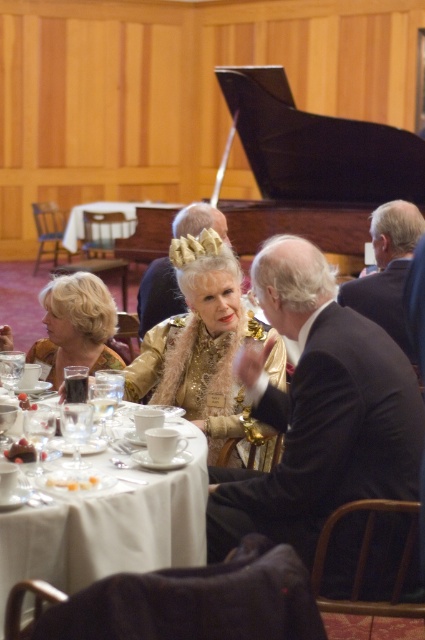
You are a guest at this event and want to pick up the white porcelain cup at center. However, the gold textured crown at center is blocking your access. Can you reach the cup without moving the crown?

The white porcelain cup at center is behind the gold textured crown at center, so you cannot reach it without moving the crown.

You are a photographer at the event and want to ensure both the gold sequined dress at center and the dark suit at right are visible in your photo. Given that the camera frame can only accommodate objects of the same size, will you need to adjust the framing to include both?

The gold sequened dress at center is larger in size than dark suit at right, so you will need to adjust the framing to ensure both are visible as their sizes differ.